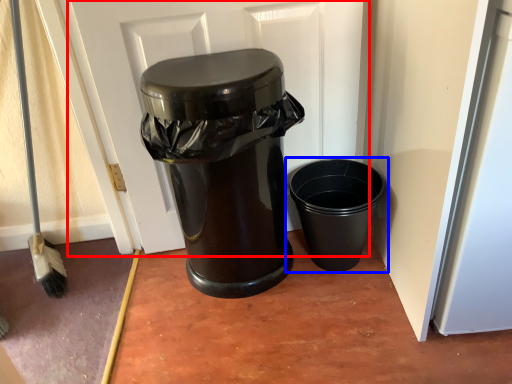
Question: Which point is closer to the camera, screen door (highlighted by a red box) or waste container (highlighted by a blue box)?

Choices:
 (A) screen door
 (B) waste container

Answer: (A)